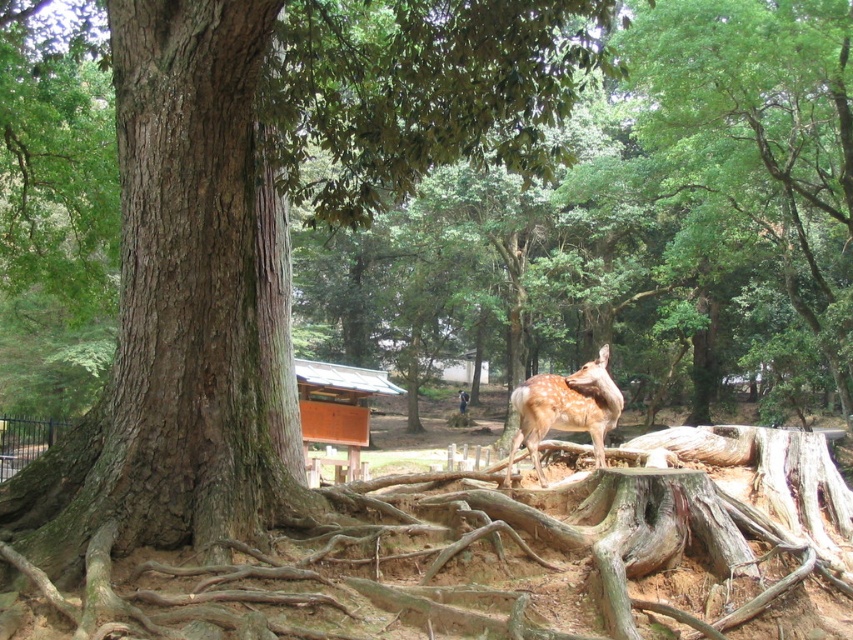
Question: From the image, what is the correct spatial relationship of brown rough tree roots at center in relation to orange wood/hardwood hut at center?

Choices:
 (A) above
 (B) below

Answer: (A)

Question: Based on their relative distances, which object is nearer to the orange wood/hardwood hut at center?

Choices:
 (A) fawn fur deer at center
 (B) brown rough tree roots at center
 (C) smooth brown bark at center

Answer: (B)

Question: Which point appears closest to the camera in this image?

Choices:
 (A) (325, 396)
 (B) (318, 545)

Answer: (B)

Question: Which is farther from the smooth brown bark at center?

Choices:
 (A) brown rough tree roots at center
 (B) orange wood/hardwood hut at center

Answer: (B)

Question: From the image, what is the correct spatial relationship of brown rough tree roots at center in relation to smooth brown bark at center?

Choices:
 (A) above
 (B) below

Answer: (B)

Question: Does fawn fur deer at center appear on the left side of orange wood/hardwood hut at center?

Choices:
 (A) yes
 (B) no

Answer: (B)